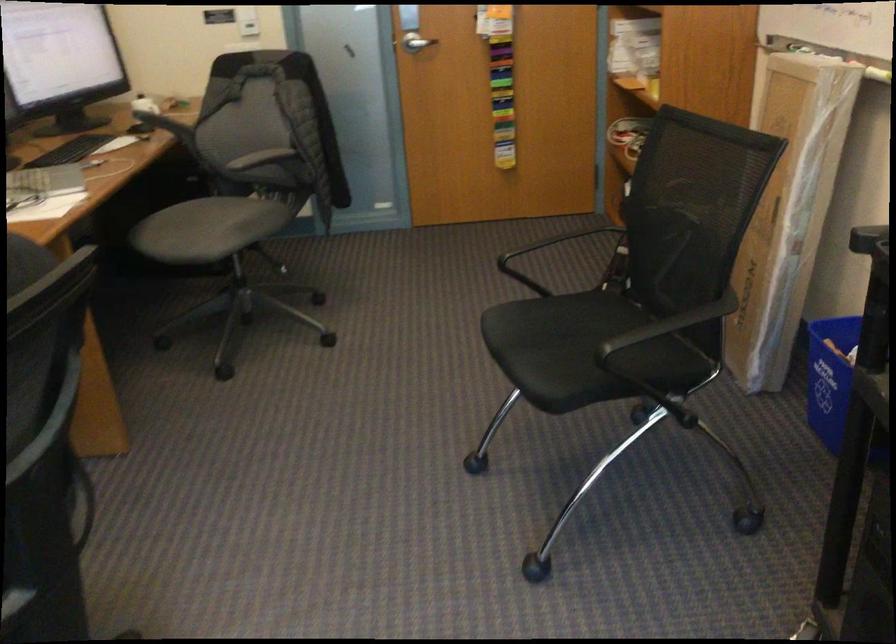
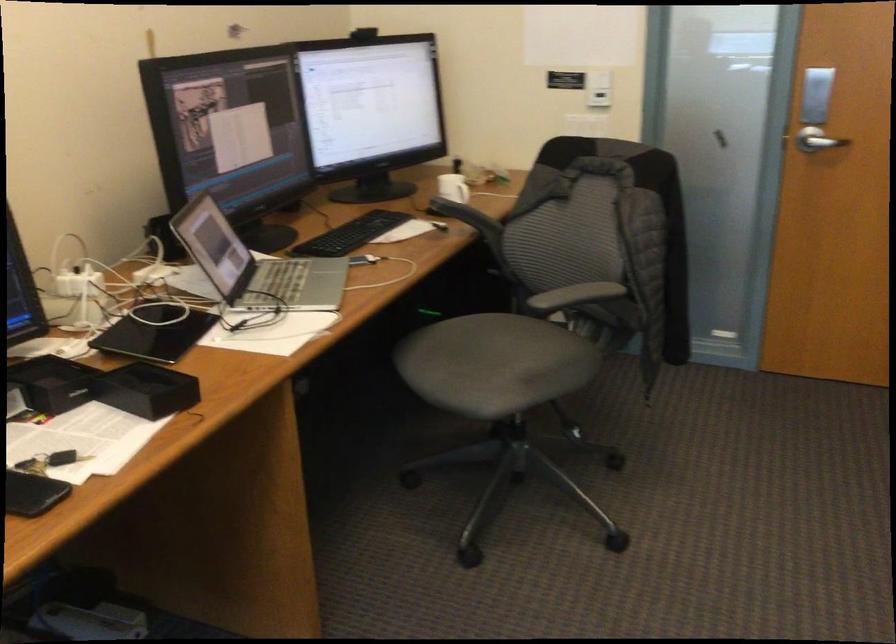
Question: The first image is from the beginning of the video and the second image is from the end. How did the camera likely rotate when shooting the video?

Choices:
 (A) Left
 (B) Right
 (C) Up
 (D) Down

Answer: (A)